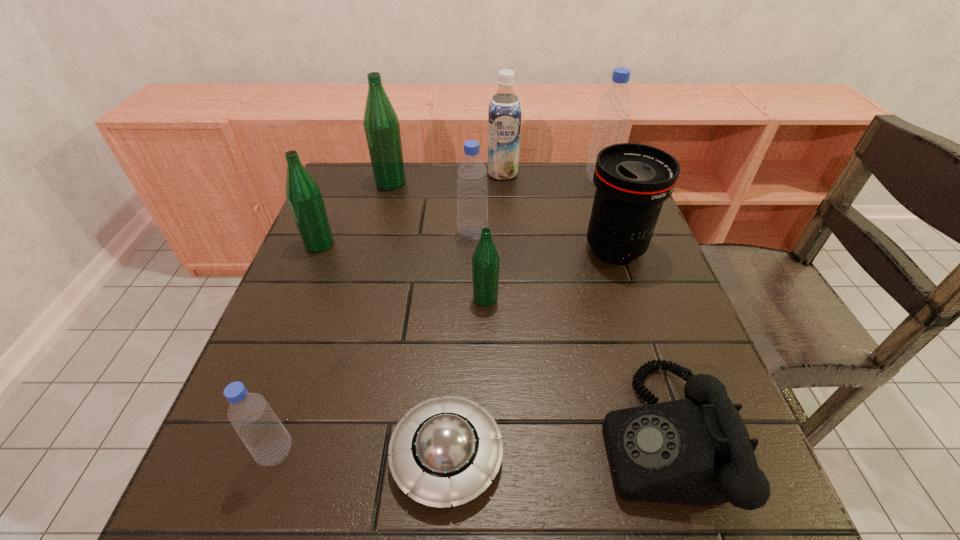
The width and height of the screenshot is (960, 540). I want to click on free space located 0.320m on the back of the second smallest green bottle, so click(x=350, y=167).

The height and width of the screenshot is (540, 960). In order to click on vacant space located 0.320m on the right of the second farthest blue bottle in this screenshot , I will do `click(618, 233)`.

This screenshot has width=960, height=540. I want to click on free space located 0.300m on the back of the black telephoto lens, so click(x=587, y=166).

The width and height of the screenshot is (960, 540). Find the location of `free space located 0.130m on the left of the nearest green bottle`. free space located 0.130m on the left of the nearest green bottle is located at coordinates (411, 298).

Image resolution: width=960 pixels, height=540 pixels. What are the coordinates of `free space located 0.250m on the back of the nearest blue bottle` in the screenshot? It's located at (322, 318).

You are a GUI agent. You are given a task and a screenshot of the screen. Output one action in this format:
    pyautogui.click(x=<x>, y=<y>)
    Task: Click on the vacant space located 0.310m on the dial of the telephone
    This screenshot has width=960, height=540.
    Given the screenshot: What is the action you would take?
    pyautogui.click(x=410, y=436)

This screenshot has width=960, height=540. I want to click on free region located on the dial of the telephone, so click(559, 436).

Where is `free space located on the dial of the telephone`? Image resolution: width=960 pixels, height=540 pixels. free space located on the dial of the telephone is located at coordinates (571, 436).

This screenshot has width=960, height=540. Identify the location of free spot located on the right of the saucer. (592, 455).

Image resolution: width=960 pixels, height=540 pixels. What are the coordinates of `soya milk located in the far edge section of the desktop` in the screenshot? It's located at (504, 112).